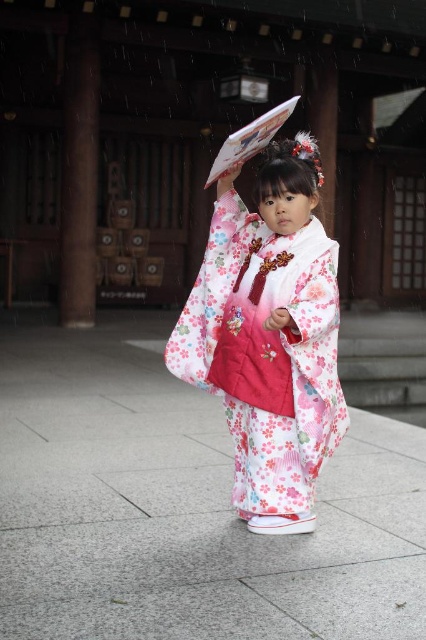
Does gray concrete pavement at center appear under floral silk kimono at center?

Yes.

Who is higher up, gray concrete pavement at center or floral silk kimono at center?

floral silk kimono at center is higher up.

Is point (124, 550) positioned after point (316, 365)?

No, it is not.

Identify the location of gray concrete pavement at center. The height and width of the screenshot is (640, 426). (184, 508).